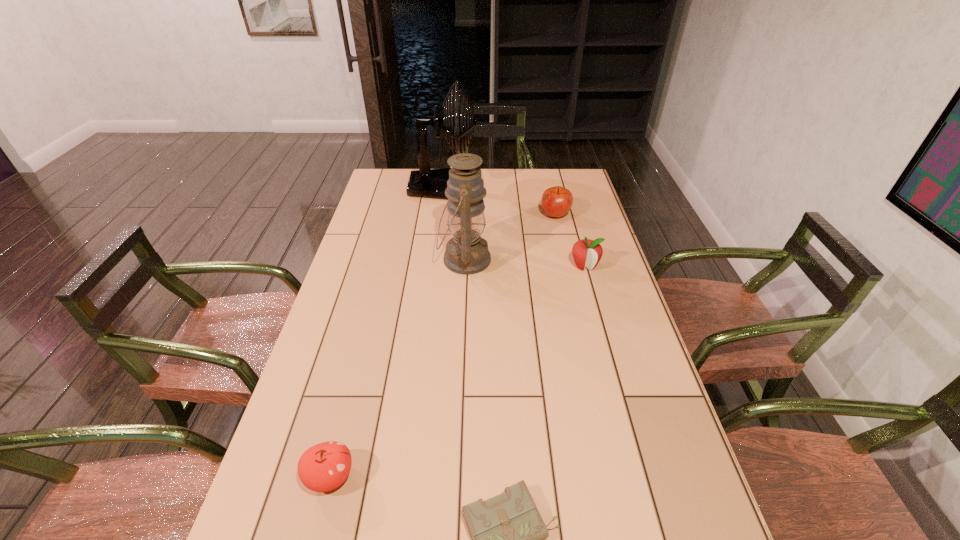
Find the location of a particular element. The width and height of the screenshot is (960, 540). fan is located at coordinates (429, 183).

The height and width of the screenshot is (540, 960). Identify the location of oil lamp. (467, 252).

You are a GUI agent. You are given a task and a screenshot of the screen. Output one action in this format:
    pyautogui.click(x=<x>, y=<y>)
    Task: Click on the farthest apple
    This screenshot has width=960, height=540.
    Given the screenshot: What is the action you would take?
    pyautogui.click(x=556, y=201)

You are a GUI agent. You are given a task and a screenshot of the screen. Output one action in this format:
    pyautogui.click(x=<x>, y=<y>)
    Task: Click on the second farthest apple
    Image resolution: width=960 pixels, height=540 pixels.
    Given the screenshot: What is the action you would take?
    pyautogui.click(x=587, y=253)

This screenshot has width=960, height=540. In order to click on the nearest apple in this screenshot , I will do `click(323, 467)`.

The width and height of the screenshot is (960, 540). I want to click on free location located in front of the fan to blow air, so click(567, 188).

Where is `vacant space located 0.290m on the back of the oil lamp`? Image resolution: width=960 pixels, height=540 pixels. vacant space located 0.290m on the back of the oil lamp is located at coordinates (468, 195).

The width and height of the screenshot is (960, 540). What are the coordinates of `vacant position located 0.250m on the back of the farthest apple` in the screenshot? It's located at (546, 176).

Identify the location of blank area located on the left of the second farthest apple. Image resolution: width=960 pixels, height=540 pixels. (502, 266).

Where is `vacant region located 0.080m on the left of the leftmost apple`? The width and height of the screenshot is (960, 540). vacant region located 0.080m on the left of the leftmost apple is located at coordinates tap(268, 476).